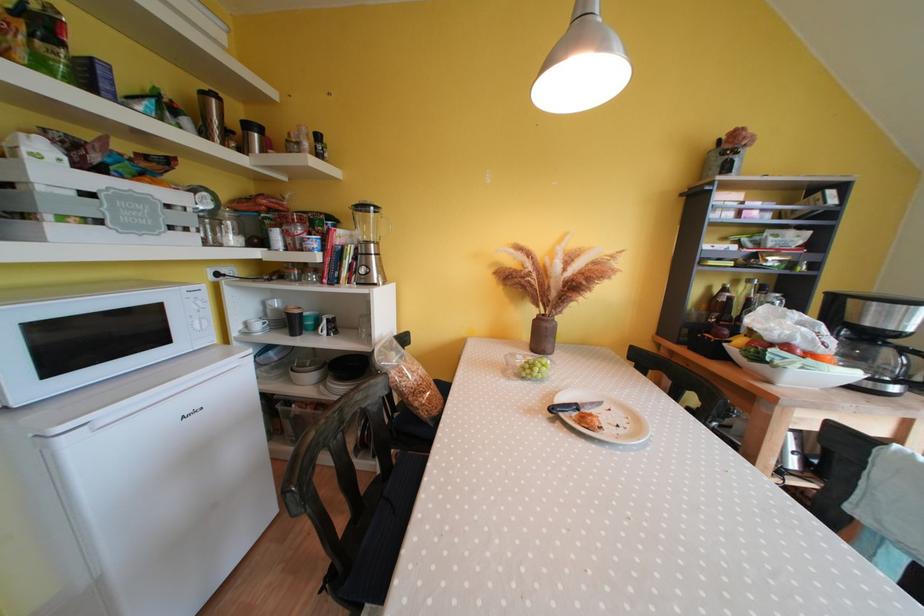
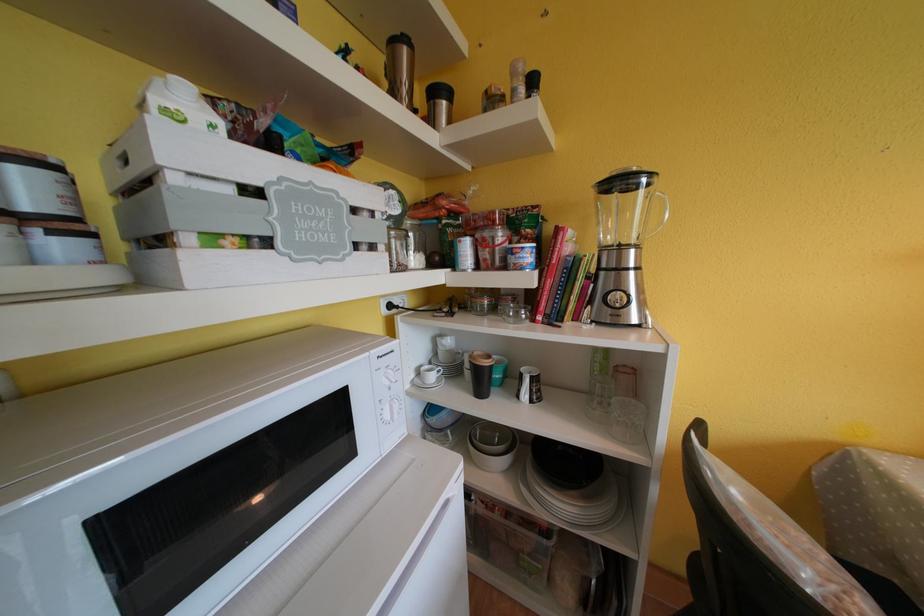
Find the pixel in the second image that matches point 332,334 in the first image.

(533, 400)